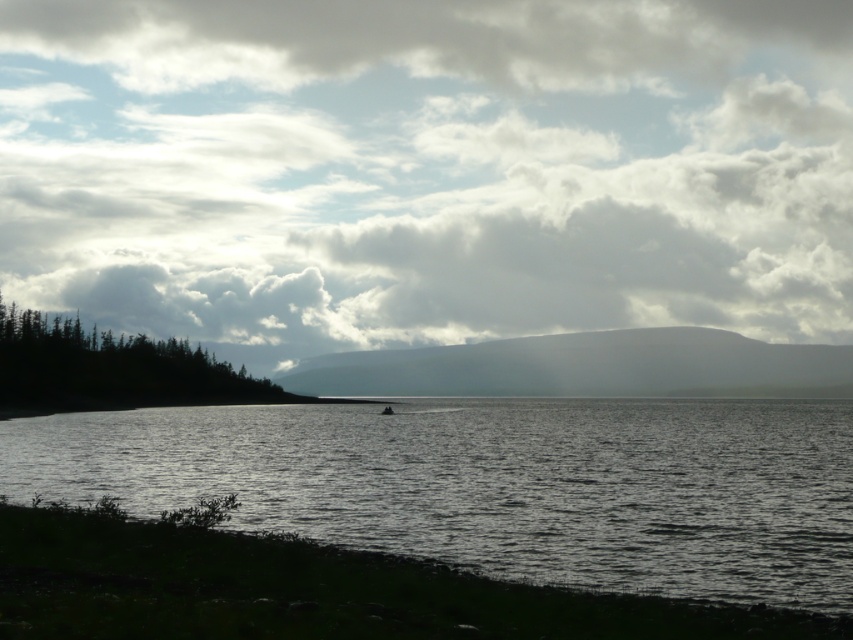
Question: Which point is closer to the camera?

Choices:
 (A) (381, 412)
 (B) (78, 566)
 (C) (213, 257)

Answer: (B)

Question: Considering the relative positions of green grass at lower left and dark gray metallic boat at center in the image provided, where is green grass at lower left located with respect to dark gray metallic boat at center?

Choices:
 (A) left
 (B) right

Answer: (B)

Question: Can you confirm if dark reflective water at center is wider than green grass at lower left?

Choices:
 (A) no
 (B) yes

Answer: (B)

Question: Which point is farther from the camera taking this photo?

Choices:
 (A) (432, 282)
 (B) (387, 410)
 (C) (209, 540)
 (D) (73, 500)

Answer: (A)

Question: Which point is closer to the camera taking this photo?

Choices:
 (A) (189, 394)
 (B) (433, 508)

Answer: (B)

Question: Does dark green textured trees at lower left appear on the left side of dark gray metallic boat at center?

Choices:
 (A) yes
 (B) no

Answer: (A)